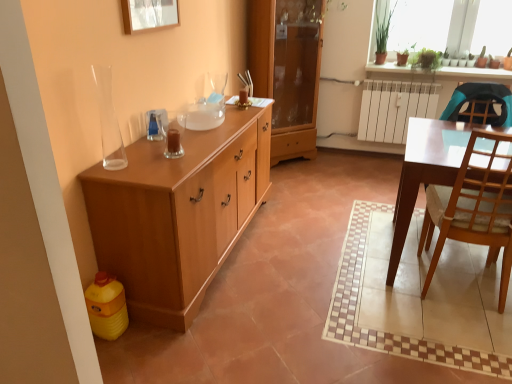
Image resolution: width=512 pixels, height=384 pixels. I want to click on free point to the right of transparent glass vase at upper left, so click(x=144, y=164).